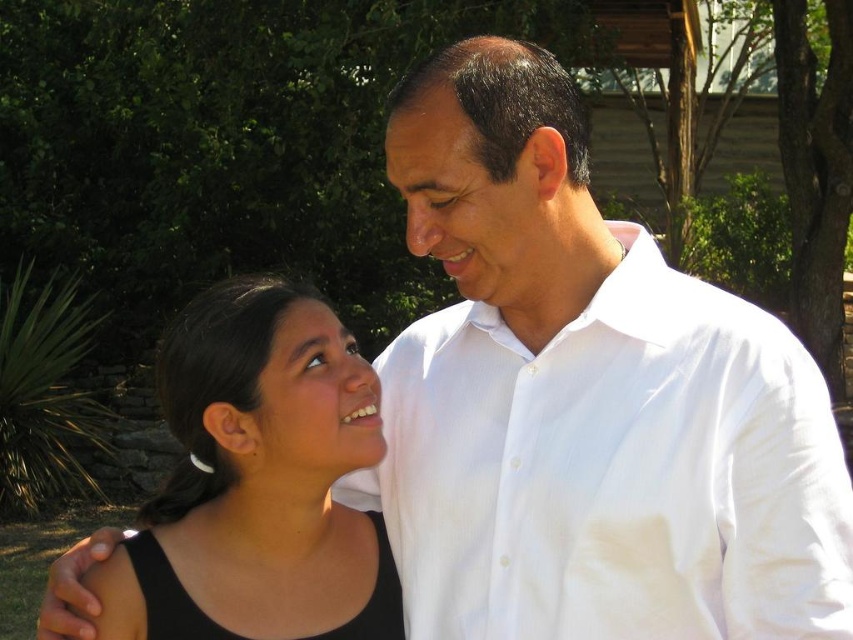
Question: Which of the following is the closest to the observer?

Choices:
 (A) (624, 260)
 (B) (198, 433)

Answer: (A)

Question: Which point is closer to the camera taking this photo?

Choices:
 (A) (247, 291)
 (B) (635, 545)

Answer: (B)

Question: Which of the following is the farthest from the observer?

Choices:
 (A) white cotton shirt at upper right
 (B) black matte tank top at center

Answer: (B)

Question: From the image, what is the correct spatial relationship of white cotton shirt at upper right in relation to black matte tank top at center?

Choices:
 (A) above
 (B) below

Answer: (A)

Question: Is white cotton shirt at upper right smaller than black matte tank top at center?

Choices:
 (A) yes
 (B) no

Answer: (B)

Question: Is white cotton shirt at upper right positioned before black matte tank top at center?

Choices:
 (A) no
 (B) yes

Answer: (B)